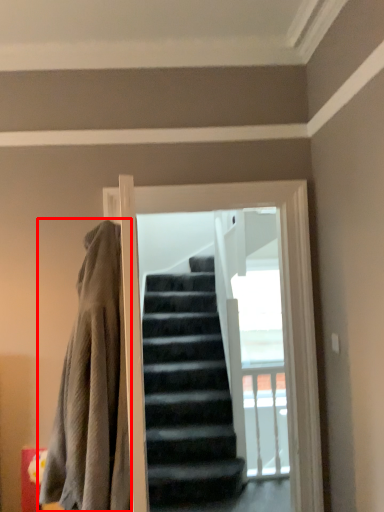
Question: Where is blanket (annotated by the red box) located in relation to screen door in the image?

Choices:
 (A) left
 (B) right

Answer: (A)